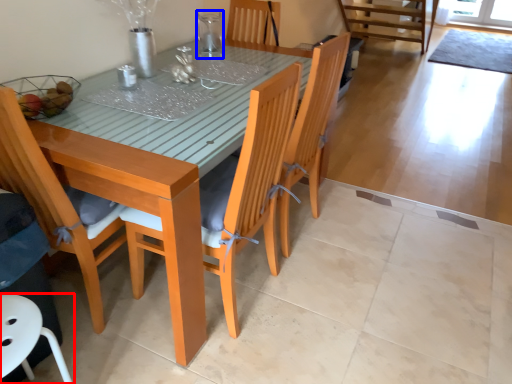
Question: Which object appears farthest to the camera in this image, chair (highlighted by a red box) or tableware (highlighted by a blue box)?

Choices:
 (A) chair
 (B) tableware

Answer: (B)